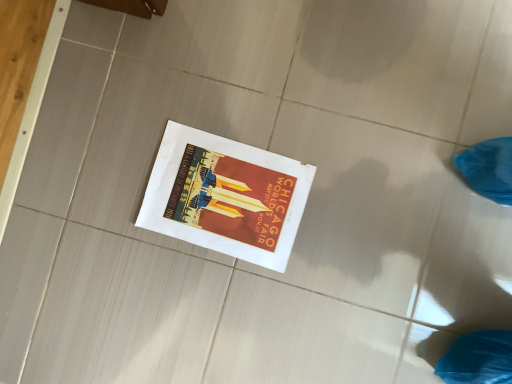
Locate an element on the screen. This screenshot has width=512, height=384. free location in front of white paper poster at center is located at coordinates (315, 282).